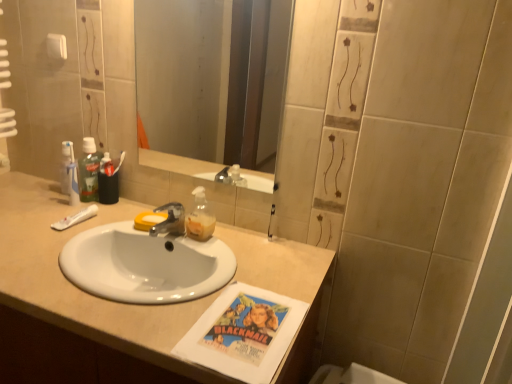
In order to click on free space in front of translucent plastic soap dispenser at center in this screenshot , I will do tap(214, 259).